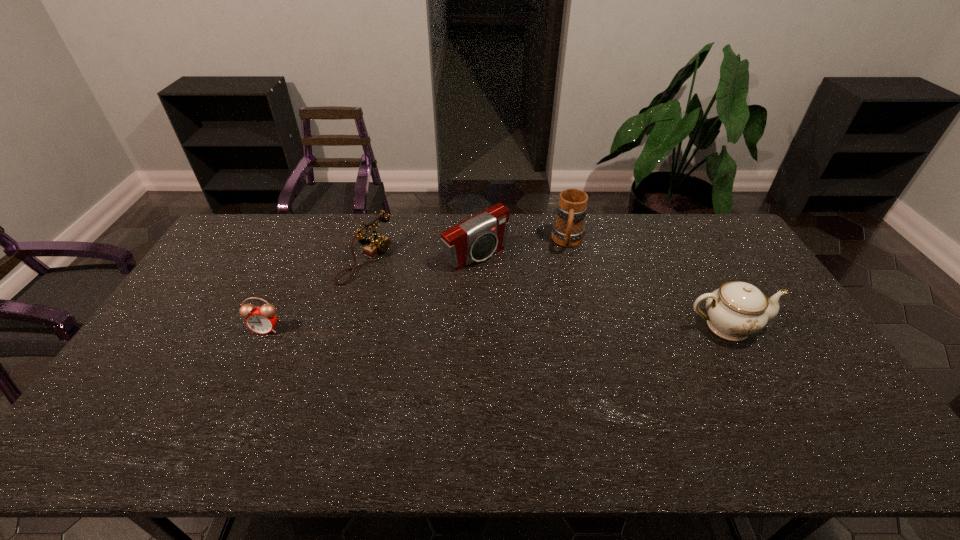
In order to click on vacant area located 0.310m on the front-facing side of the telephone in this screenshot , I will do `click(462, 307)`.

Find the location of a particular element. This screenshot has width=960, height=540. free space located on the front-facing side of the telephone is located at coordinates (448, 301).

The image size is (960, 540). I want to click on blank area located on the front-facing side of the telephone, so click(x=450, y=303).

Where is `blank space located on the side of the mug with the handle`? This screenshot has height=540, width=960. blank space located on the side of the mug with the handle is located at coordinates (563, 300).

Find the location of a particular element. vacant space situated 0.270m on the side of the mug with the handle is located at coordinates (561, 312).

This screenshot has height=540, width=960. Identify the location of vacant space located on the side of the mug with the handle. (557, 339).

At what (x,y) coordinates should I click in order to perform the action: click on camera present at the far edge. Please return your answer as a coordinate pair (x, y). The image size is (960, 540). Looking at the image, I should click on (475, 239).

At what (x,y) coordinates should I click in order to perform the action: click on telephone present at the far edge. Please return your answer as a coordinate pair (x, y). Image resolution: width=960 pixels, height=540 pixels. Looking at the image, I should click on (377, 244).

The height and width of the screenshot is (540, 960). I want to click on mug that is at the far edge, so click(x=568, y=230).

Locate an element on the screen. object present at the right edge is located at coordinates (736, 310).